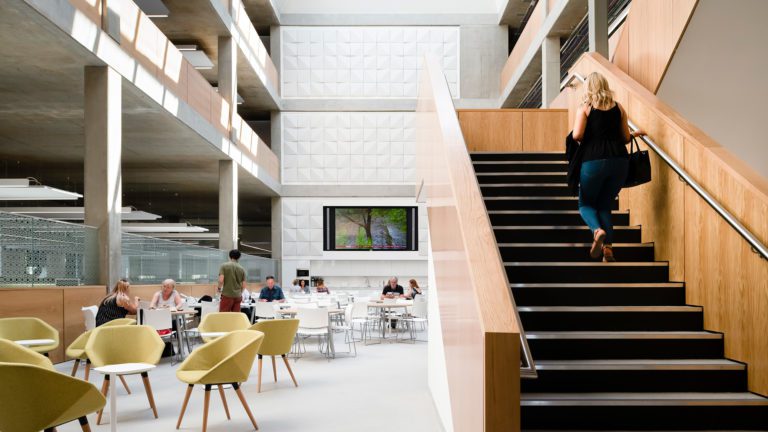
This screenshot has width=768, height=432. I want to click on seating, so click(x=15, y=329), click(x=17, y=375), click(x=110, y=347), click(x=75, y=351), click(x=212, y=357), click(x=222, y=317), click(x=279, y=325).